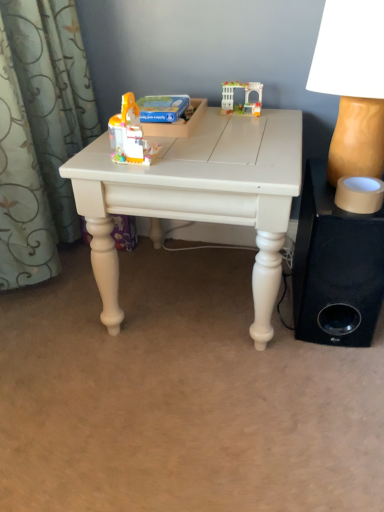
Question: Can you confirm if translucent plastic toy at center, which is the 1th toy in left-to-right order, is positioned to the left of white matte table at center?

Choices:
 (A) yes
 (B) no

Answer: (A)

Question: From the image's perspective, is translucent plastic toy at center, which is the 2th toy in back-to-front order, located beneath white matte table at center?

Choices:
 (A) yes
 (B) no

Answer: (B)

Question: From a real-world perspective, is translucent plastic toy at center, which is counted as the 2th toy, starting from the top, positioned under white matte table at center based on gravity?

Choices:
 (A) yes
 (B) no

Answer: (B)

Question: Is there a large distance between translucent plastic toy at center, which is counted as the 2th toy, starting from the top, and white matte table at center?

Choices:
 (A) no
 (B) yes

Answer: (A)

Question: Does translucent plastic toy at center, the 2th toy when ordered from right to left, come behind white matte table at center?

Choices:
 (A) yes
 (B) no

Answer: (A)

Question: Does translucent plastic toy at center, the 2th toy when ordered from right to left, lie in front of white matte table at center?

Choices:
 (A) yes
 (B) no

Answer: (B)

Question: Can you confirm if white matte table at center is thinner than white plastic toy at upper center, arranged as the first toy when viewed from the top?

Choices:
 (A) yes
 (B) no

Answer: (B)

Question: Is white matte table at center bigger than white plastic toy at upper center, placed as the 2th toy when sorted from left to right?

Choices:
 (A) yes
 (B) no

Answer: (A)

Question: Can you confirm if white matte table at center is smaller than white plastic toy at upper center, the second toy positioned from the bottom?

Choices:
 (A) no
 (B) yes

Answer: (A)

Question: From a real-world perspective, is white matte table at center physically above white plastic toy at upper center, placed as the 2th toy when sorted from left to right?

Choices:
 (A) no
 (B) yes

Answer: (A)

Question: From the image's perspective, does white matte table at center appear higher than white plastic toy at upper center, arranged as the first toy when viewed from the top?

Choices:
 (A) yes
 (B) no

Answer: (B)

Question: From the image's perspective, is white matte table at center located beneath white plastic toy at upper center, arranged as the first toy when viewed from the top?

Choices:
 (A) no
 (B) yes

Answer: (B)

Question: Is black fabric speaker at lower right surrounding white matte table at center?

Choices:
 (A) yes
 (B) no

Answer: (B)